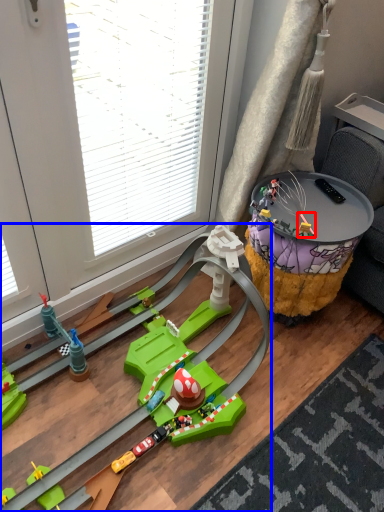
Question: Among these objects, which one is nearest to the camera, toy (highlighted by a red box) or toy (highlighted by a blue box)?

Choices:
 (A) toy
 (B) toy

Answer: (B)